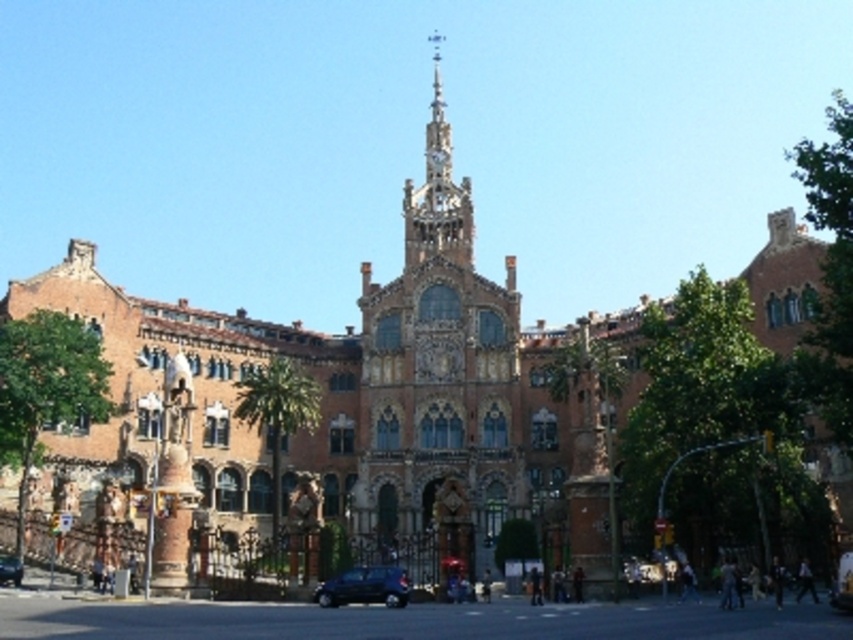
You are a photographer trying to capture the golden ornate tower at center and the shiny black car at lower center in a single frame. Based on the scene, which object would appear larger in your photo?

The golden ornate tower at center would appear larger in the photo since it has a larger size compared to the shiny black car at lower center according to the description.

You are standing in a park adjacent to the grand building. You want to take a photo of the golden ornate tower at center from a distance where it will appear at least 10 feet tall in your camera viewfinder. Given that your camera has a 50mm lens and you are currently 292.56 feet away from the tower, will the tower appear large enough in the photo?

The golden ornate tower at center is 292.56 feet away from the viewer. To determine if it will appear at least 10 feet tall in the camera viewfinder, we can use the formula for angular size. However, without knowing the actual height of the tower, we cannot accurately calculate its apparent size. Therefore, it is impossible to confirm if the tower will appear large enough based on the given information.

You are a photographer planning to capture the grand building with both cars in the frame. Since the shiny black car at lower center and metallic blue car at lower left are of different widths, which car will require more space to fit entirely in the photo from your current position?

The shiny black car at lower center requires more space because its width is larger than the metallic blue car at lower left.